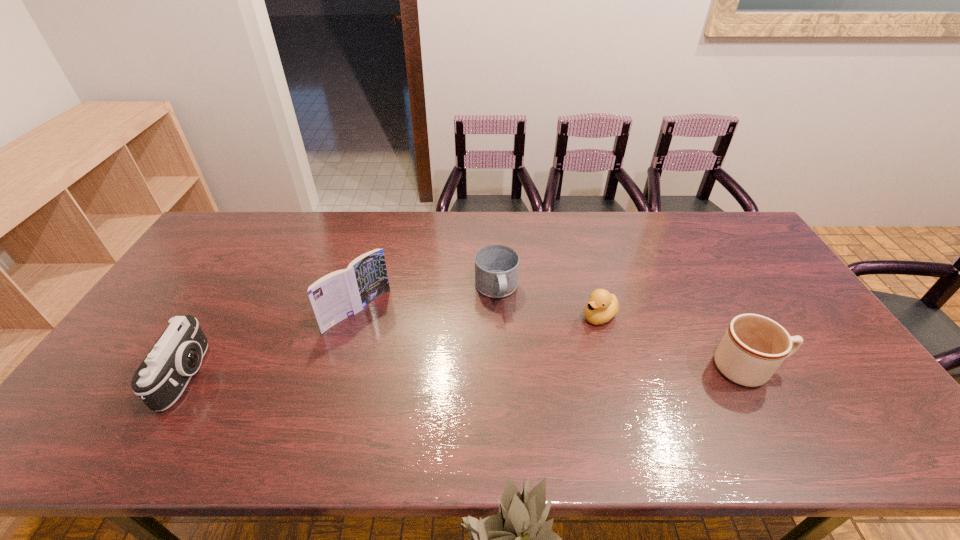
Where is `vacant spot on the desktop that is between the leftmost object and the right mug and is positioned on the front cover of the book`? vacant spot on the desktop that is between the leftmost object and the right mug and is positioned on the front cover of the book is located at coordinates (430, 372).

At what (x,y) coordinates should I click in order to perform the action: click on vacant space on the desktop that is between the camera and the nearer mug and is positioned on the side of the third object from right to left with the handle. Please return your answer as a coordinate pair (x, y). Looking at the image, I should click on (517, 371).

The width and height of the screenshot is (960, 540). I want to click on free space on the desktop that is between the camera and the rightmost object and is positioned facing forward on the duckling, so click(x=519, y=371).